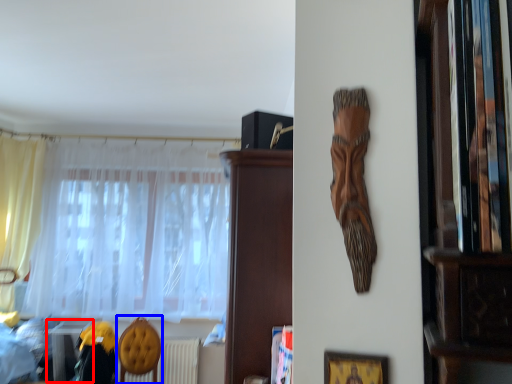
Question: Which object is closer to the camera taking this photo, table (highlighted by a red box) or armchair (highlighted by a blue box)?

Choices:
 (A) table
 (B) armchair

Answer: (B)